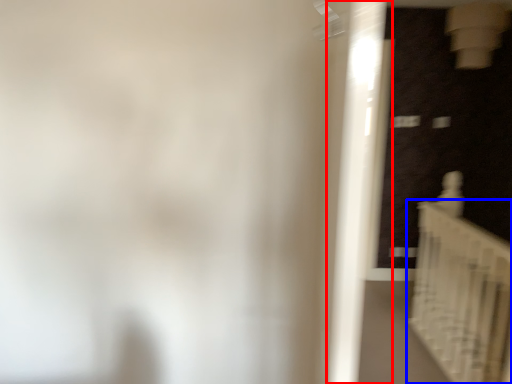
Question: Which of the following is the closest to the observer, door (highlighted by a red box) or stairs (highlighted by a blue box)?

Choices:
 (A) door
 (B) stairs

Answer: (A)